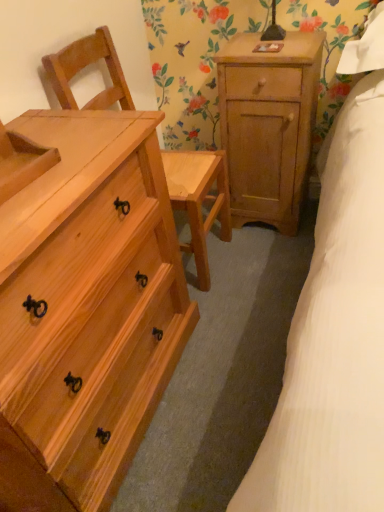
Question: Does natural wood nightstand at upper right appear on the left side of natural wood chair at left?

Choices:
 (A) yes
 (B) no

Answer: (B)

Question: Considering the relative sizes of natural wood nightstand at upper right and natural wood chair at left in the image provided, is natural wood nightstand at upper right smaller than natural wood chair at left?

Choices:
 (A) yes
 (B) no

Answer: (A)

Question: Is natural wood nightstand at upper right directly adjacent to natural wood chair at left?

Choices:
 (A) no
 (B) yes

Answer: (A)

Question: Considering the relative positions of natural wood nightstand at upper right and natural wood chair at left in the image provided, is natural wood nightstand at upper right to the right of natural wood chair at left from the viewer's perspective?

Choices:
 (A) yes
 (B) no

Answer: (A)

Question: From the image's perspective, is natural wood nightstand at upper right under natural wood chair at left?

Choices:
 (A) no
 (B) yes

Answer: (A)

Question: From a real-world perspective, is natural wood chest of drawers at left physically located above or below natural wood chair at left?

Choices:
 (A) above
 (B) below

Answer: (B)

Question: Based on their positions, is natural wood chest of drawers at left located to the left or right of natural wood chair at left?

Choices:
 (A) right
 (B) left

Answer: (B)

Question: Is point (29, 178) positioned closer to the camera than point (180, 192)?

Choices:
 (A) farther
 (B) closer

Answer: (B)

Question: Do you think natural wood chest of drawers at left is within natural wood chair at left, or outside of it?

Choices:
 (A) inside
 (B) outside

Answer: (B)

Question: Relative to natural wood chest of drawers at left, is natural wood nightstand at upper right in front or behind?

Choices:
 (A) front
 (B) behind

Answer: (B)

Question: Is natural wood nightstand at upper right taller or shorter than natural wood chest of drawers at left?

Choices:
 (A) tall
 (B) short

Answer: (B)

Question: Is point (226, 57) closer or farther from the camera than point (82, 190)?

Choices:
 (A) farther
 (B) closer

Answer: (A)

Question: Would you say natural wood nightstand at upper right is to the left or to the right of natural wood chest of drawers at left in the picture?

Choices:
 (A) right
 (B) left

Answer: (A)

Question: Looking at their shapes, would you say natural wood chest of drawers at left is wider or thinner than natural wood nightstand at upper right?

Choices:
 (A) thin
 (B) wide

Answer: (B)

Question: Relative to natural wood nightstand at upper right, is natural wood chest of drawers at left in front or behind?

Choices:
 (A) front
 (B) behind

Answer: (A)